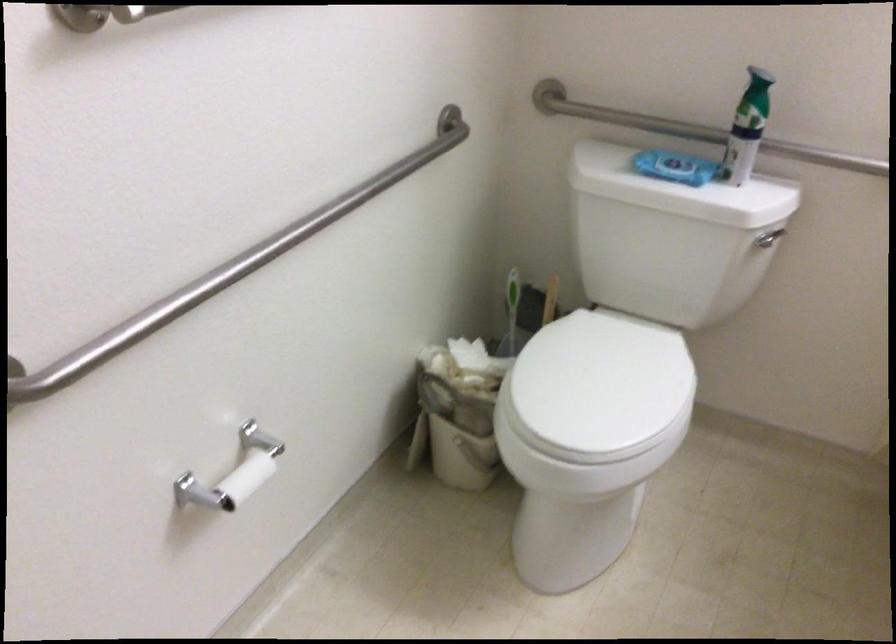
Image resolution: width=896 pixels, height=644 pixels. Find the location of `toilet flush handle`. toilet flush handle is located at coordinates (769, 238).